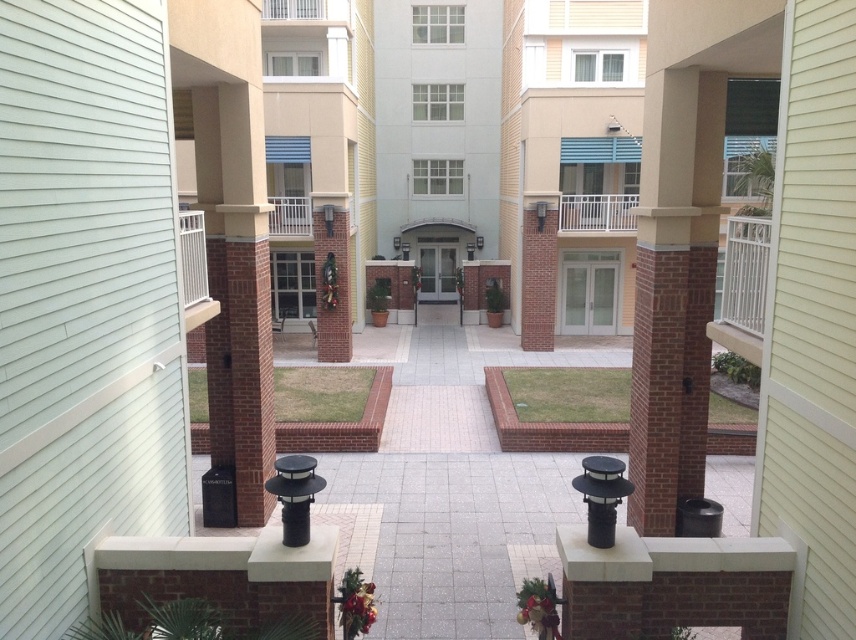
Question: Does white painted wood balcony at left appear over white metal railing at upper center?

Choices:
 (A) yes
 (B) no

Answer: (B)

Question: Does white painted wood balcony at left have a lesser width compared to white metal balcony at upper center?

Choices:
 (A) yes
 (B) no

Answer: (A)

Question: Is white metal railing at upper center positioned in front of white metal balcony at upper center?

Choices:
 (A) no
 (B) yes

Answer: (A)

Question: Which point is closer to the camera?

Choices:
 (A) (186, 316)
 (B) (308, 221)
 (C) (629, 216)

Answer: (A)

Question: Which of these objects is positioned closest to the white metal railing at upper center?

Choices:
 (A) white metal balcony at upper center
 (B) white painted wood balcony at left

Answer: (A)

Question: Which point is farther from the camera taking this photo?

Choices:
 (A) (620, 198)
 (B) (207, 298)

Answer: (A)